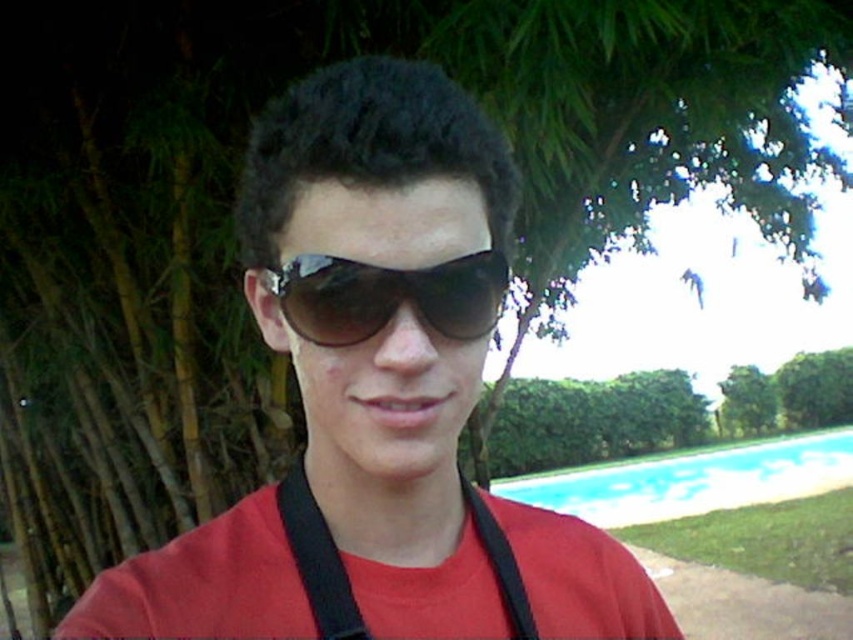
You are standing at the edge of the pool area and want to reach the point marked at coordinates point [426,92]. If your stride length is 2 inches per step, how many steps will it take you to reach that point?

The distance between you and point [426,92] is 14.69 inches. Since each step covers 2 inches, dividing 14.69 by 2 gives approximately 7.345 steps. Rounding up, it would take 8 steps to reach the point.

You are a photographer standing 10 feet away from the pool area. You notice the sunglasses at center. Can you reach them without moving closer than your current position?

The sunglasses at center is 13.12 inches from viewer. Since 13.12 inches is less than 10 feet, you are already closer than 10 feet, so you can reach the sunglasses at center without needing to move closer.